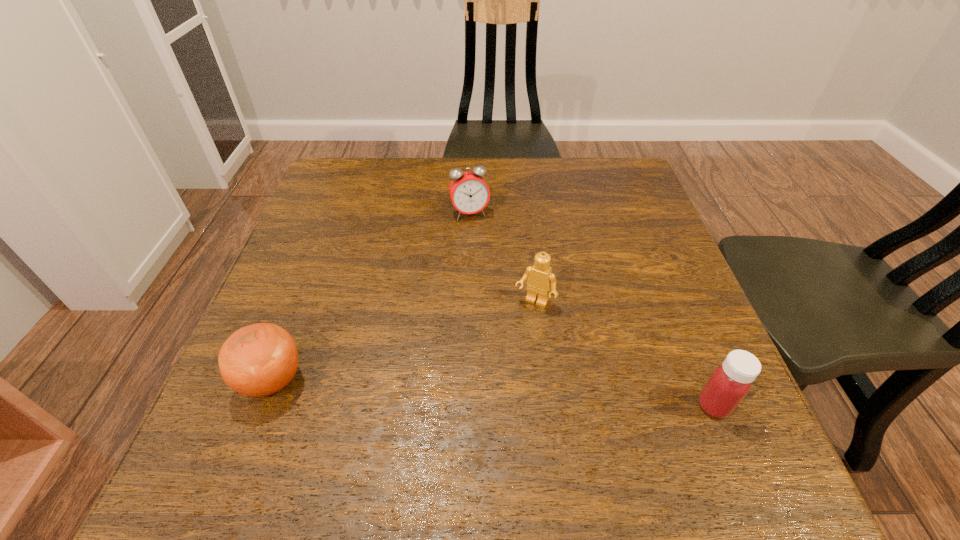
Find the location of a particular element. The width and height of the screenshot is (960, 540). free space located on the face of the third object from left to right is located at coordinates (474, 409).

Identify the location of vacant space located on the front-facing side of the alarm clock. [485, 253].

Identify the location of blank space located on the front-facing side of the alarm clock. (507, 318).

This screenshot has height=540, width=960. In order to click on blank space located 0.200m on the front-facing side of the alarm clock in this screenshot , I will do tap(492, 276).

This screenshot has height=540, width=960. What are the coordinates of `orange at the near edge` in the screenshot? It's located at (257, 360).

The image size is (960, 540). In order to click on medicine situated at the near edge in this screenshot , I will do `click(730, 382)`.

This screenshot has height=540, width=960. Identify the location of object that is at the left edge. (257, 360).

This screenshot has width=960, height=540. I want to click on object that is at the right edge, so click(730, 382).

Where is `object present at the near left corner`? This screenshot has width=960, height=540. object present at the near left corner is located at coordinates (257, 360).

Where is `object that is at the near right corner`? object that is at the near right corner is located at coordinates (730, 382).